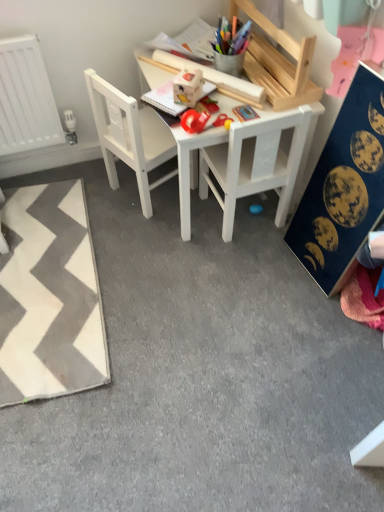
Identify the location of free location in front of white matte chair at center, the second chair from the right. This screenshot has height=512, width=384. (137, 234).